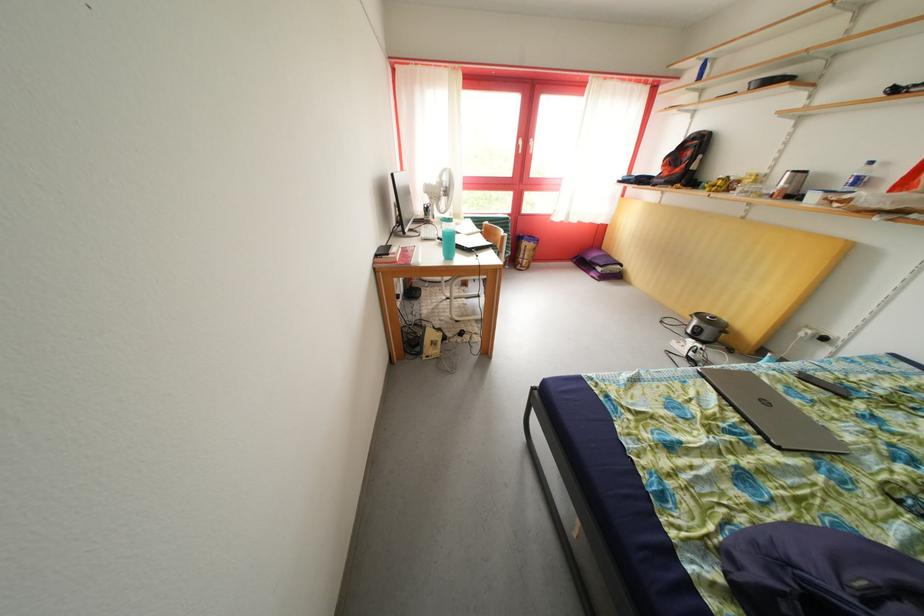
You are a GUI agent. You are given a task and a screenshot of the screen. Output one action in this format:
    pyautogui.click(x=<x>, y=<y>)
    Task: Click on the blue backpack
    This screenshot has height=616, width=924.
    Given the screenshot: What is the action you would take?
    pyautogui.click(x=819, y=573)